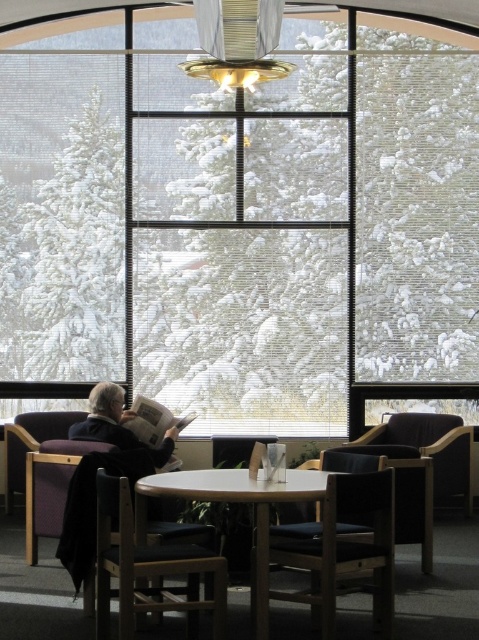
Which is more to the right, transparent glass window at center or light brown wooden table at center?

Positioned to the right is light brown wooden table at center.

Is transparent glass window at center taller than light brown wooden table at center?

Incorrect, transparent glass window at center's height is not larger of light brown wooden table at center's.

Between point (444, 157) and point (257, 634), which one is positioned in front?

Point (257, 634) is more forward.

Identify the location of transparent glass window at center. This screenshot has width=479, height=640. (241, 218).

Is point (25, 166) positioned behind point (421, 566)?

Yes, it is.

Which is more to the right, transparent glass window at center or wooden armchair at lower right?

wooden armchair at lower right

Locate an element on the screen. transparent glass window at center is located at coordinates (241, 218).

This screenshot has width=479, height=640. I want to click on transparent glass window at center, so click(x=241, y=218).

Is transparent glass window at center smaller than dark brown leather armchair at lower right?

Yes, transparent glass window at center is smaller than dark brown leather armchair at lower right.

Which is below, transparent glass window at center or dark brown leather armchair at lower right?

dark brown leather armchair at lower right is lower down.

Is point (237, 400) closer to camera compared to point (468, 492)?

No.

Identify the location of transparent glass window at center. The width and height of the screenshot is (479, 640). (241, 218).